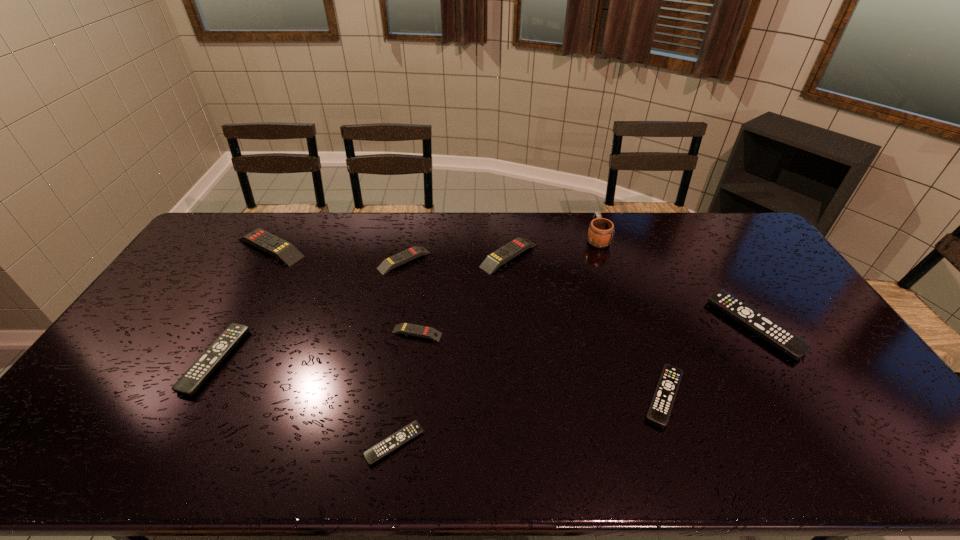
Where is `free space located on the left of the second biggest black remote control`? The height and width of the screenshot is (540, 960). free space located on the left of the second biggest black remote control is located at coordinates click(172, 360).

Find the location of a particular element. The width and height of the screenshot is (960, 540). vacant space positioned on the front of the nearest yellow remote control is located at coordinates (407, 406).

I want to click on free space located on the left of the second smallest black remote control, so click(x=561, y=396).

The height and width of the screenshot is (540, 960). Find the location of `vacant space situated 0.150m on the back of the second black remote control from left to right`. vacant space situated 0.150m on the back of the second black remote control from left to right is located at coordinates (405, 372).

Image resolution: width=960 pixels, height=540 pixels. I want to click on mug present at the far edge, so click(x=601, y=231).

Where is `object present at the near edge`? The height and width of the screenshot is (540, 960). object present at the near edge is located at coordinates (388, 445).

Image resolution: width=960 pixels, height=540 pixels. Identify the location of object that is at the left edge. (286, 252).

You are a GUI agent. You are given a task and a screenshot of the screen. Output one action in this format:
    pyautogui.click(x=<x>, y=<y>)
    Task: Click on the object present at the right edge
    
    Given the screenshot: What is the action you would take?
    pyautogui.click(x=778, y=336)

Locate an element on the screen. object that is at the far left corner is located at coordinates (286, 252).

At what (x,y) coordinates should I click in order to perform the action: click on free space at the far edge of the desktop. Please return your answer as a coordinate pair (x, y). The image size is (960, 540). Looking at the image, I should click on (332, 218).